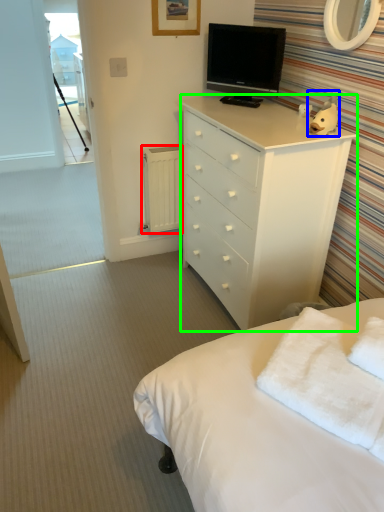
Question: Which is farther away from radiator (highlighted by a red box)? toy (highlighted by a blue box) or chest of drawers (highlighted by a green box)?

Choices:
 (A) toy
 (B) chest of drawers

Answer: (A)